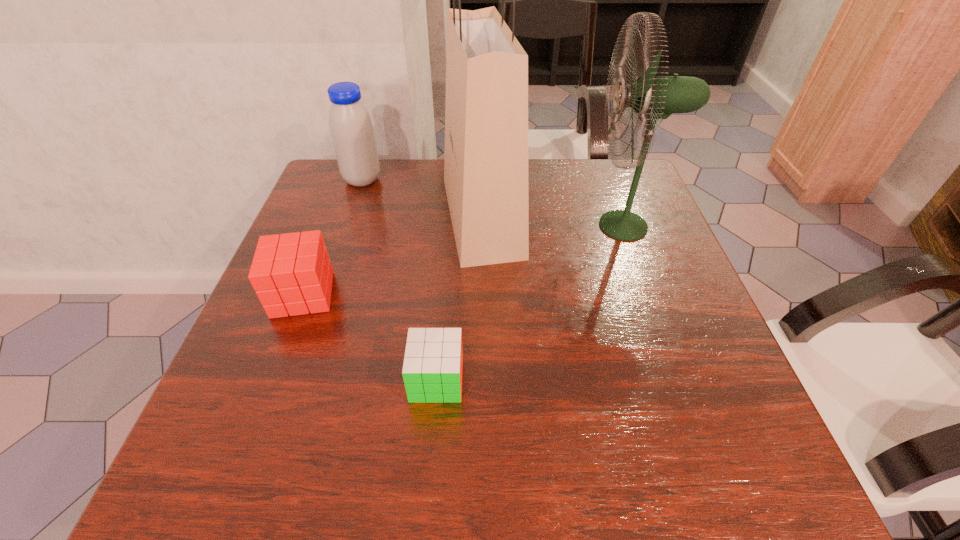
At what (x,y) coordinates should I click in order to perform the action: click on free space between the fourth tallest object and the shopping bag. Please return your answer as a coordinate pair (x, y). The height and width of the screenshot is (540, 960). Looking at the image, I should click on (393, 255).

In order to click on free space between the right cube and the shopping bag in this screenshot , I will do `click(459, 298)`.

Identify which object is the second closest to the shopping bag. Please provide its 2D coordinates. Your answer should be formatted as a tuple, i.e. [(x, y)], where the tuple contains the x and y coordinates of a point satisfying the conditions above.

[(351, 129)]

Where is `the fourth closest object to the second shortest object`? the fourth closest object to the second shortest object is located at coordinates (652, 97).

Locate an element on the screen. blank area in the image that satisfies the following two spatial constraints: 1. on the front side of the shorter cube; 2. on the right side of the soya milk is located at coordinates (x=294, y=380).